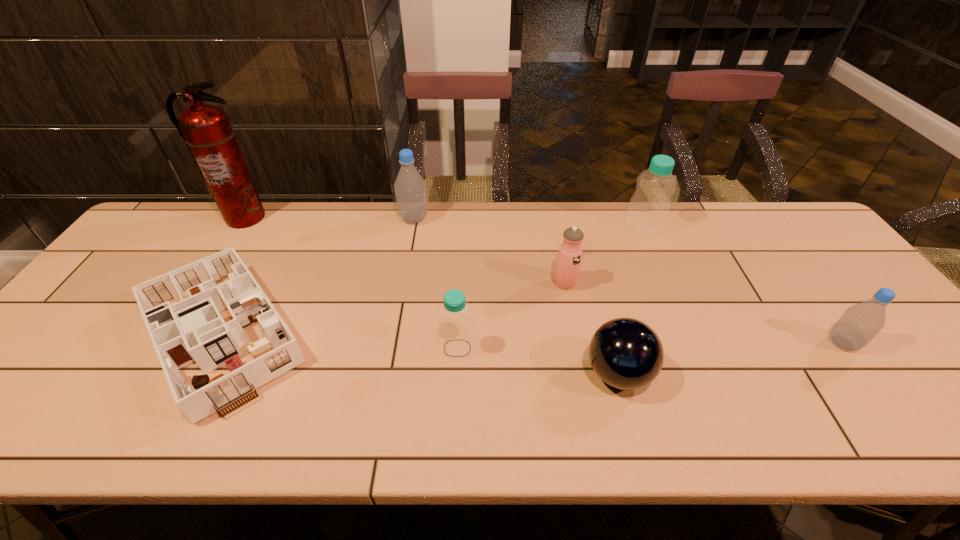
Image resolution: width=960 pixels, height=540 pixels. I want to click on fire extinguisher, so click(x=205, y=129).

Where is `the right blue bottle`? The height and width of the screenshot is (540, 960). the right blue bottle is located at coordinates (649, 206).

This screenshot has height=540, width=960. I want to click on the farther blue bottle, so click(649, 206).

The image size is (960, 540). I want to click on the sixth object from right to left, so click(410, 190).

The width and height of the screenshot is (960, 540). Identify the location of the farther gray bottle. (410, 190).

In order to click on thermos bottle in this screenshot , I will do `click(569, 257)`.

Where is `the nearer gray bottle`? This screenshot has width=960, height=540. the nearer gray bottle is located at coordinates (859, 324).

The height and width of the screenshot is (540, 960). Identify the location of the smaller gray bottle. pyautogui.click(x=859, y=324).

You are a GUI agent. You are given a task and a screenshot of the screen. Output one action in this format:
    pyautogui.click(x=<x>, y=<y>)
    Task: Click on the third bottle from right to left
    Image resolution: width=960 pixels, height=540 pixels.
    Given the screenshot: What is the action you would take?
    pyautogui.click(x=456, y=332)

Where is `the smaller blue bottle`? the smaller blue bottle is located at coordinates (456, 332).